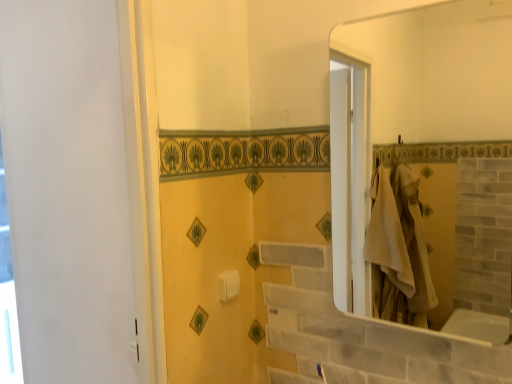
Question: Considering the relative sizes of white glossy mirror at upper right and white glossy window at left in the image provided, is white glossy mirror at upper right smaller than white glossy window at left?

Choices:
 (A) no
 (B) yes

Answer: (A)

Question: Can you confirm if white glossy mirror at upper right is shorter than white glossy window at left?

Choices:
 (A) yes
 (B) no

Answer: (A)

Question: Considering the relative sizes of white glossy mirror at upper right and white glossy window at left in the image provided, is white glossy mirror at upper right wider than white glossy window at left?

Choices:
 (A) yes
 (B) no

Answer: (A)

Question: Is white glossy mirror at upper right aimed at white glossy window at left?

Choices:
 (A) yes
 (B) no

Answer: (B)

Question: From the image's perspective, does white glossy mirror at upper right appear higher than white glossy window at left?

Choices:
 (A) yes
 (B) no

Answer: (A)

Question: From a real-world perspective, is white glossy mirror at upper right above or below white plastic towel bar at center?

Choices:
 (A) below
 (B) above

Answer: (B)

Question: Is white glossy mirror at upper right to the left or to the right of white plastic towel bar at center in the image?

Choices:
 (A) left
 (B) right

Answer: (B)

Question: Choose the correct answer: Is white glossy mirror at upper right inside white plastic towel bar at center or outside it?

Choices:
 (A) outside
 (B) inside

Answer: (A)

Question: Is point (468, 11) positioned closer to the camera than point (228, 289)?

Choices:
 (A) closer
 (B) farther

Answer: (B)

Question: Is white plastic towel bar at center taller or shorter than white glossy mirror at upper right?

Choices:
 (A) short
 (B) tall

Answer: (A)

Question: Would you say white plastic towel bar at center is inside or outside white glossy mirror at upper right?

Choices:
 (A) inside
 (B) outside

Answer: (B)

Question: Looking at the image, does white plastic towel bar at center seem bigger or smaller compared to white glossy mirror at upper right?

Choices:
 (A) big
 (B) small

Answer: (B)

Question: Is white plastic towel bar at center in front of or behind white glossy mirror at upper right in the image?

Choices:
 (A) front
 (B) behind

Answer: (B)

Question: Is white glossy mirror at upper right wider or thinner than white glossy window at left?

Choices:
 (A) thin
 (B) wide

Answer: (B)

Question: From a real-world perspective, is white glossy mirror at upper right physically located above or below white glossy window at left?

Choices:
 (A) below
 (B) above

Answer: (B)